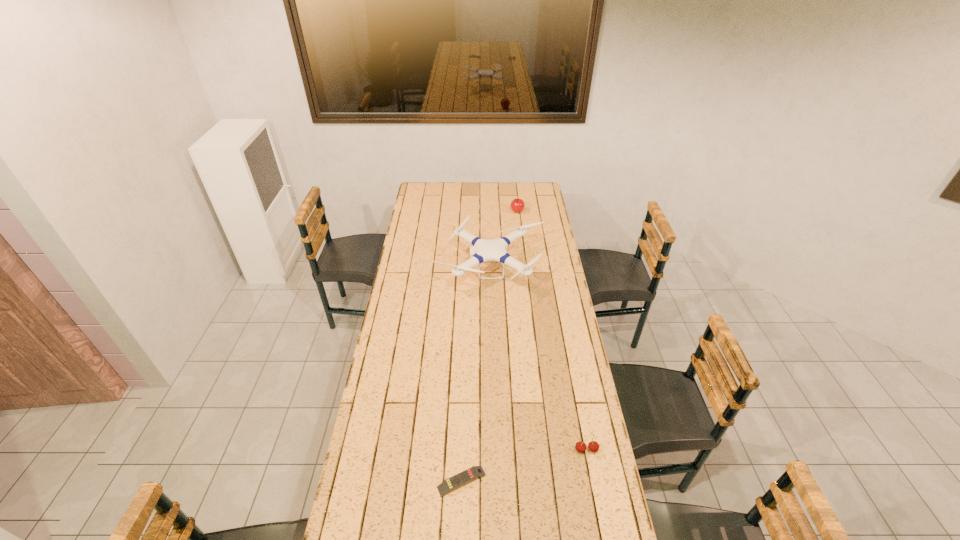
At what (x,y) coordinates should I click in order to perform the action: click on unoccupied area between the tallest object and the nearest object. Please return your answer as a coordinate pair (x, y). The width and height of the screenshot is (960, 540). Looking at the image, I should click on 476,375.

Where is `free point between the remote control and the farther cherry`? free point between the remote control and the farther cherry is located at coordinates (490, 347).

The width and height of the screenshot is (960, 540). I want to click on empty space between the nearest object and the farthest object, so click(x=490, y=347).

At what (x,y) coordinates should I click in order to perform the action: click on free space between the shortest object and the second nearest object. Please return your answer as a coordinate pair (x, y). Looking at the image, I should click on (524, 465).

At what (x,y) coordinates should I click in order to perform the action: click on free space between the farther cherry and the remote control. Please return your answer as a coordinate pair (x, y). Looking at the image, I should click on (490, 347).

Identify the location of free spot between the nearer cherry and the left cherry. (552, 331).

The image size is (960, 540). In order to click on object that ranks as the second closest to the farther cherry in this screenshot , I will do `click(593, 446)`.

Identify the location of object that stands as the second closest to the farthest object. The width and height of the screenshot is (960, 540). (593, 446).